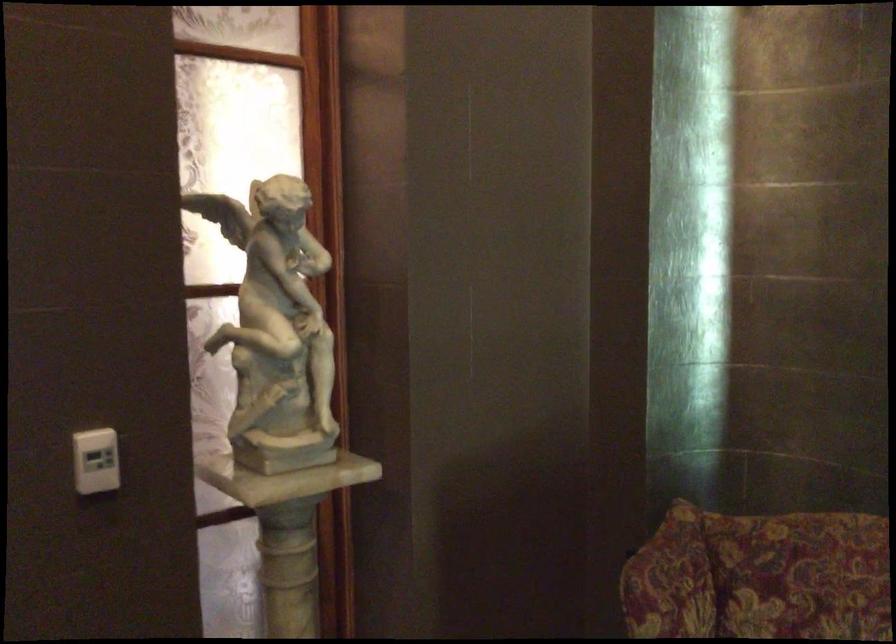
What do you see at coordinates (670, 581) in the screenshot? I see `the red patterned sofa armrest` at bounding box center [670, 581].